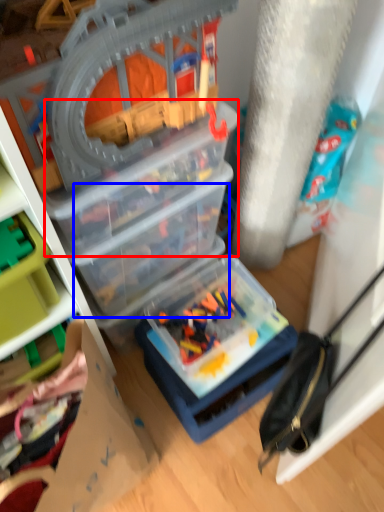
Question: Among these objects, which one is farthest to the camera, box (highlighted by a red box) or box (highlighted by a blue box)?

Choices:
 (A) box
 (B) box

Answer: (B)